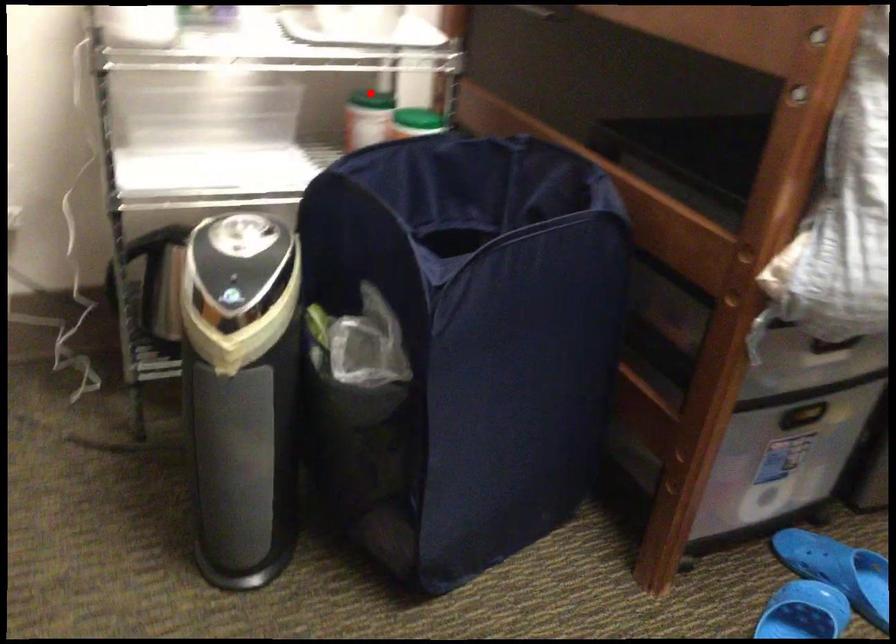
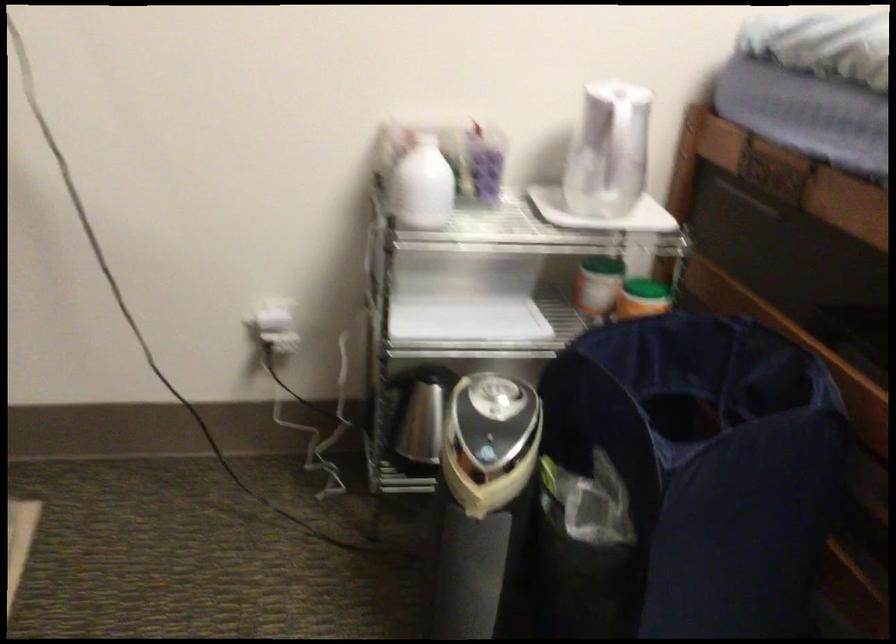
Question: I am providing you with two images of the same scene from different viewpoints. A red point is marked on the first image. Is the red point's position out of view in image 2?

Choices:
 (A) Yes
 (B) No

Answer: (B)